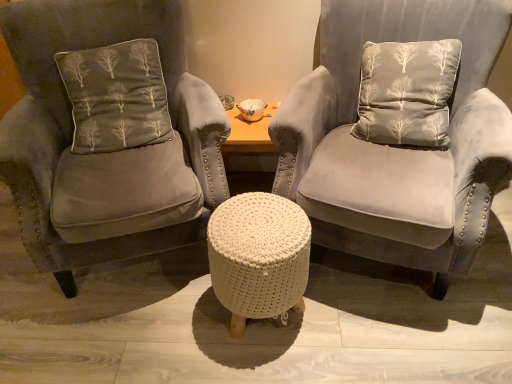
Question: Considering the positions of velvet gray armchair at center, which ranks as the 2th chair in right-to-left order, and velvet gray chair at center, placed as the 2th chair when sorted from left to right, in the image, is velvet gray armchair at center, which ranks as the 2th chair in right-to-left order, wider or thinner than velvet gray chair at center, placed as the 2th chair when sorted from left to right,?

Choices:
 (A) thin
 (B) wide

Answer: (B)

Question: Relative to velvet gray chair at center, arranged as the first chair when viewed from the right, is velvet gray armchair at center, the first chair from the left, in front or behind?

Choices:
 (A) front
 (B) behind

Answer: (B)

Question: Which object is positioned farthest from the dark gray velvet cushion at left?

Choices:
 (A) velvet gray armchair at center, the first chair from the left
 (B) white knitted pouf at center
 (C) velvet gray chair at center, arranged as the first chair when viewed from the right

Answer: (C)

Question: Considering the real-world distances, which object is closest to the velvet gray armchair at center, which ranks as the 2th chair in right-to-left order?

Choices:
 (A) dark gray velvet cushion at left
 (B) white knitted pouf at center
 (C) velvet gray chair at center, placed as the 2th chair when sorted from left to right

Answer: (A)